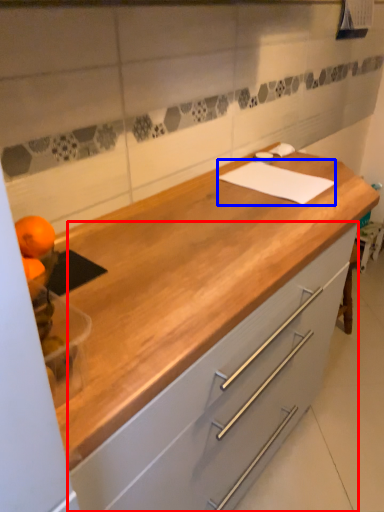
Question: Which object is further to the camera taking this photo, cabinetry (highlighted by a red box) or notepad (highlighted by a blue box)?

Choices:
 (A) cabinetry
 (B) notepad

Answer: (B)